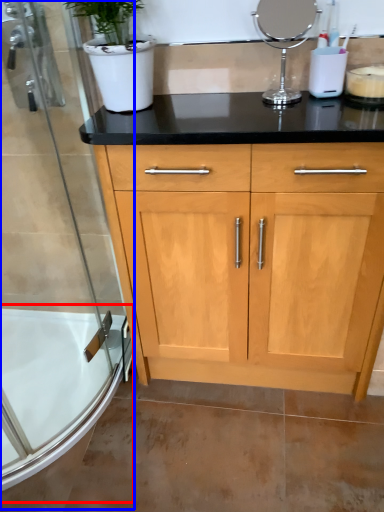
Question: Which object is further to the camera taking this photo, bath (highlighted by a red box) or shower door (highlighted by a blue box)?

Choices:
 (A) bath
 (B) shower door

Answer: (A)